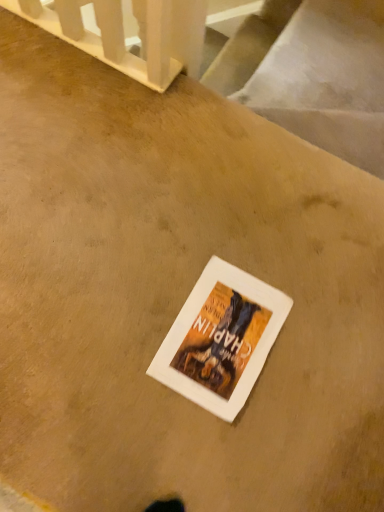
Identify the location of white paper book at center. This screenshot has height=512, width=384. (221, 339).

This screenshot has width=384, height=512. What do you see at coordinates (221, 339) in the screenshot? I see `white paper book at center` at bounding box center [221, 339].

Find the location of a particular element. Image resolution: width=384 pixels, height=512 pixels. white paper book at center is located at coordinates (221, 339).